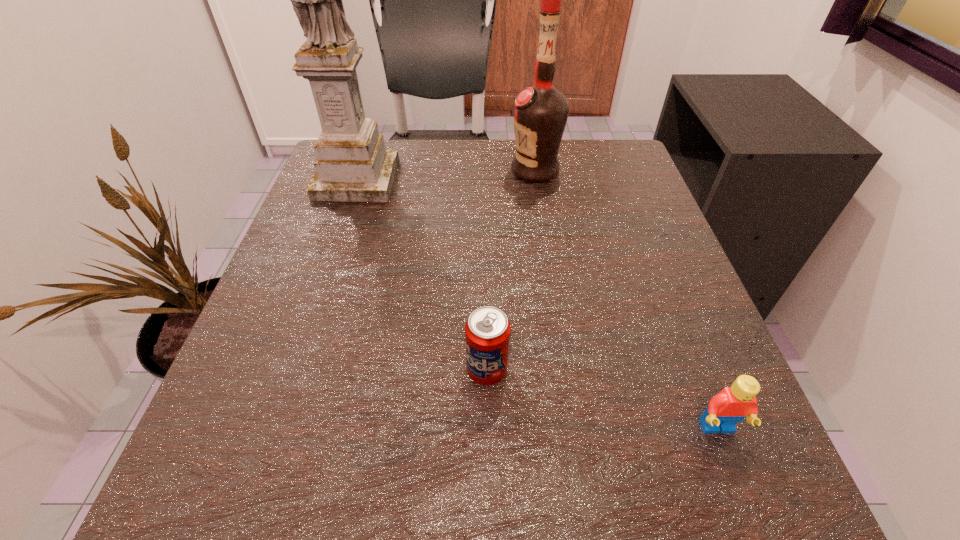
Identify the location of free space located 0.090m on the front and back of the second object from right to left. The height and width of the screenshot is (540, 960). (470, 170).

This screenshot has height=540, width=960. In order to click on vacant region located 0.150m on the front and back of the second object from right to left in this screenshot , I will do `click(444, 170)`.

You are a GUI agent. You are given a task and a screenshot of the screen. Output one action in this format:
    pyautogui.click(x=<x>, y=<y>)
    Task: Click on the free spot located 0.200m on the back of the second nearest object
    Image resolution: width=960 pixels, height=540 pixels.
    Given the screenshot: What is the action you would take?
    pyautogui.click(x=486, y=261)

Locate an element on the screen. sculpture positioned at the far edge is located at coordinates (352, 165).

Where is `liquor that is at the far edge`? Image resolution: width=960 pixels, height=540 pixels. liquor that is at the far edge is located at coordinates (540, 112).

Find the location of `object present at the left edge`. object present at the left edge is located at coordinates (352, 165).

Where is `object that is at the right edge`? This screenshot has height=540, width=960. object that is at the right edge is located at coordinates (732, 404).

This screenshot has width=960, height=540. Identify the location of object that is positioned at the far left corner. (352, 165).

The image size is (960, 540). What are the coordinates of `vacant space at the far edge of the desktop` in the screenshot? It's located at (509, 163).

This screenshot has height=540, width=960. Find the location of `vacant position at the near edge of the desktop`. vacant position at the near edge of the desktop is located at coordinates (558, 517).